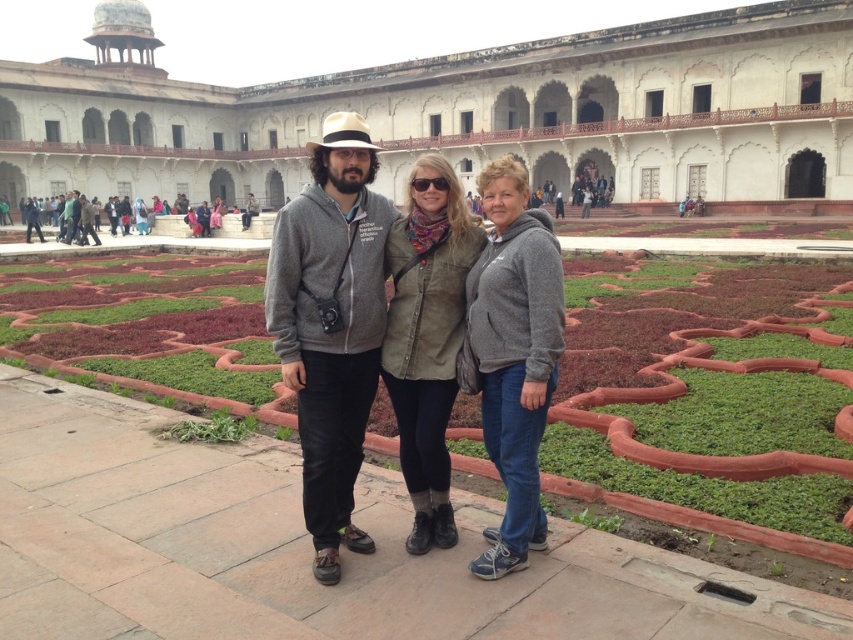
You are a photographer planning to take a group photo of the green grass at center and the gray hoodie at center. Which object should you place on the left side of your camera frame to ensure they are aligned with their current positions?

You should place the green grass at center on the left side of your camera frame because it is already positioned on the left side of the gray hoodie at center.